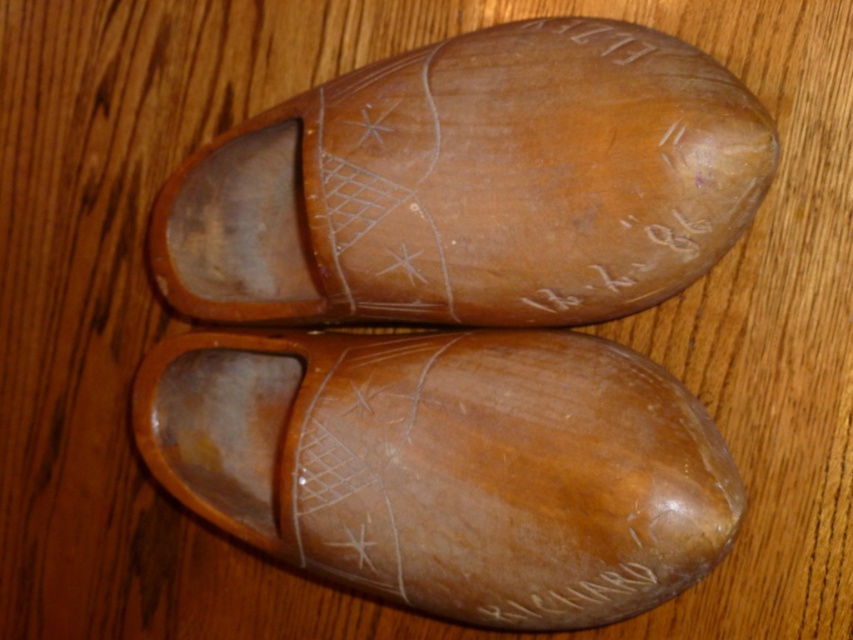
Measure the distance between matte brown wooden shoe at center and light brown wood shoe at center.

matte brown wooden shoe at center is 7.99 inches away from light brown wood shoe at center.

This screenshot has height=640, width=853. Identify the location of matte brown wooden shoe at center. (474, 184).